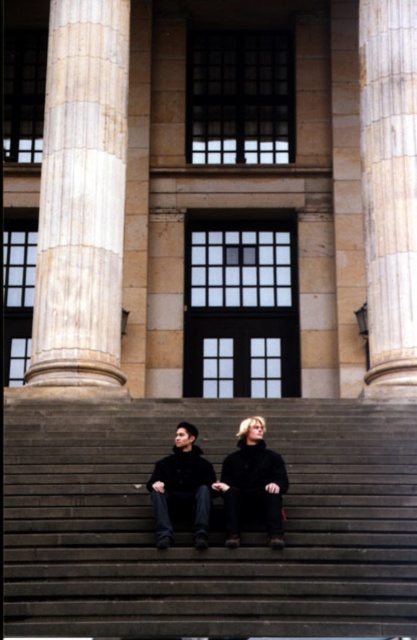
Question: Which object is closer to the camera taking this photo?

Choices:
 (A) dark brown leather jacket at center
 (B) smooth concrete stairs at center
 (C) white marble column at left
 (D) black woolen coat at center

Answer: (B)

Question: Which object is closer to the camera taking this photo?

Choices:
 (A) dark brown leather jacket at center
 (B) black woolen coat at center
 (C) marble column at right
 (D) smooth concrete stairs at center

Answer: (D)

Question: Which of the following is the farthest from the observer?

Choices:
 (A) dark brown leather jacket at center
 (B) white marble column at left

Answer: (B)

Question: Is smooth concrete stairs at center to the right of marble column at right from the viewer's perspective?

Choices:
 (A) yes
 (B) no

Answer: (B)

Question: Considering the relative positions of smooth concrete stairs at center and black woolen coat at center in the image provided, where is smooth concrete stairs at center located with respect to black woolen coat at center?

Choices:
 (A) below
 (B) above

Answer: (A)

Question: Is marble column at right to the right of dark brown leather jacket at center from the viewer's perspective?

Choices:
 (A) yes
 (B) no

Answer: (A)